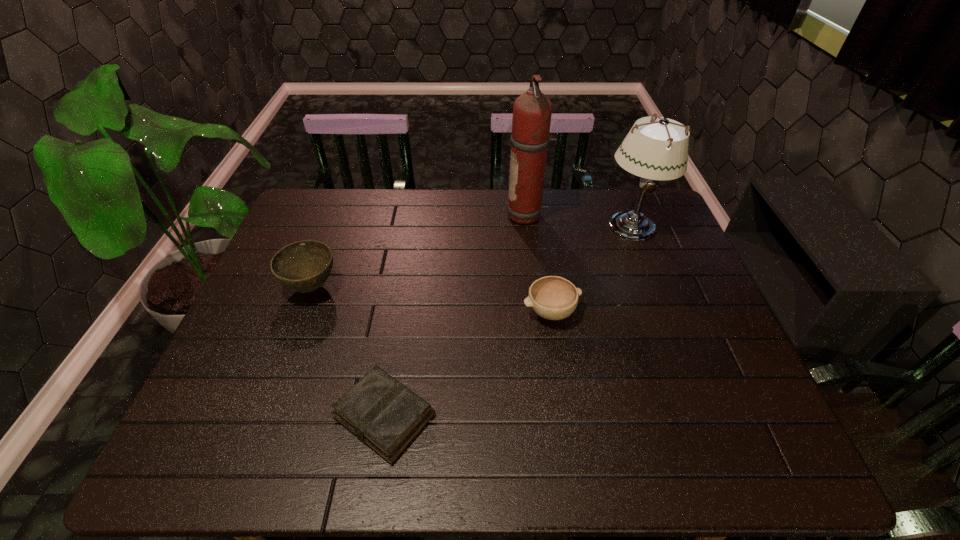
Find the location of a particular element. Image resolution: width=960 pixels, height=540 pixels. fire extinguisher is located at coordinates (532, 110).

Locate an element on the screen. The width and height of the screenshot is (960, 540). lampshade is located at coordinates (658, 150).

You are a GUI agent. You are given a task and a screenshot of the screen. Output one action in this format:
    pyautogui.click(x=<x>, y=<y>)
    Task: Click on the fourth shortest object
    Image resolution: width=960 pixels, height=540 pixels.
    Given the screenshot: What is the action you would take?
    pyautogui.click(x=658, y=150)

Find the location of `the leftmost object`. the leftmost object is located at coordinates (303, 266).

You are a GUI agent. You are given a task and a screenshot of the screen. Output one action in this format:
    pyautogui.click(x=<x>, y=<y>)
    Task: Click on the third shortest object
    Image resolution: width=960 pixels, height=540 pixels.
    Given the screenshot: What is the action you would take?
    pyautogui.click(x=303, y=266)

Find the location of a particular element. This screenshot has width=960, height=540. the right bowl is located at coordinates (552, 297).

Locate an element on the screen. the shorter bowl is located at coordinates (552, 297).

This screenshot has width=960, height=540. I want to click on the shortest object, so click(384, 414).

The height and width of the screenshot is (540, 960). What are the coordinates of `the nearest object` in the screenshot? It's located at (384, 414).

At what (x,y) coordinates should I click in order to perform the action: click on vacant region located on the side of the tallest object with the label and nozzle. Please return your answer as a coordinate pair (x, y). Looking at the image, I should click on (437, 216).